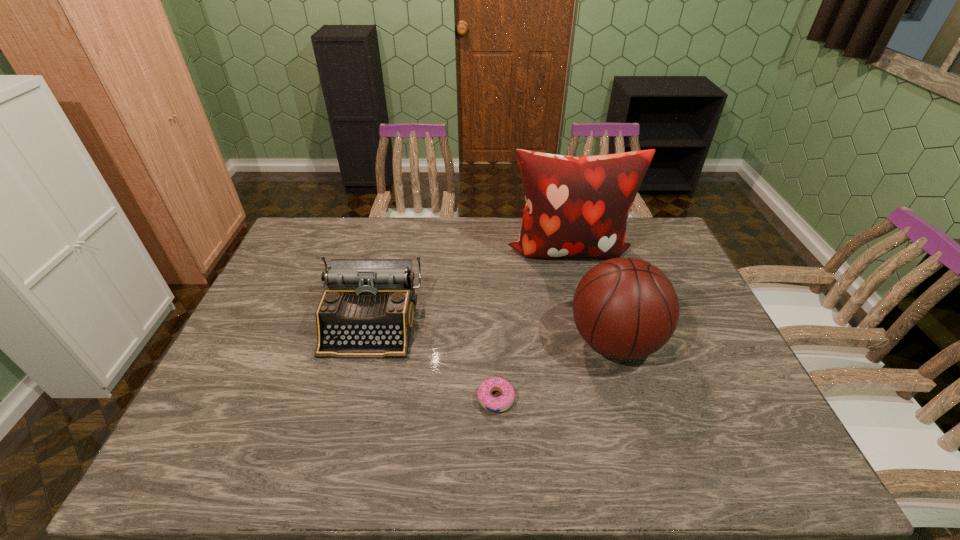
Find the location of a particular element. The image size is (960, 540). free area in between the second object from left to right and the third shortest object is located at coordinates click(x=555, y=370).

Image resolution: width=960 pixels, height=540 pixels. Find the location of `the second closest object to the shortest object`. the second closest object to the shortest object is located at coordinates (367, 311).

I want to click on object that is the third closest to the tallest object, so click(493, 404).

Where is `vacant point that satisfies the following two spatial constraints: 1. on the keyboard of the third tallest object; 2. on the right side of the basketball`? Image resolution: width=960 pixels, height=540 pixels. vacant point that satisfies the following two spatial constraints: 1. on the keyboard of the third tallest object; 2. on the right side of the basketball is located at coordinates (366, 341).

In order to click on free location that satisfies the following two spatial constraints: 1. on the keyboard of the leftmost object; 2. on the left side of the shortest object in this screenshot , I will do `click(351, 399)`.

I want to click on free space that satisfies the following two spatial constraints: 1. on the keyboard of the basketball; 2. on the right side of the second shortest object, so click(x=366, y=341).